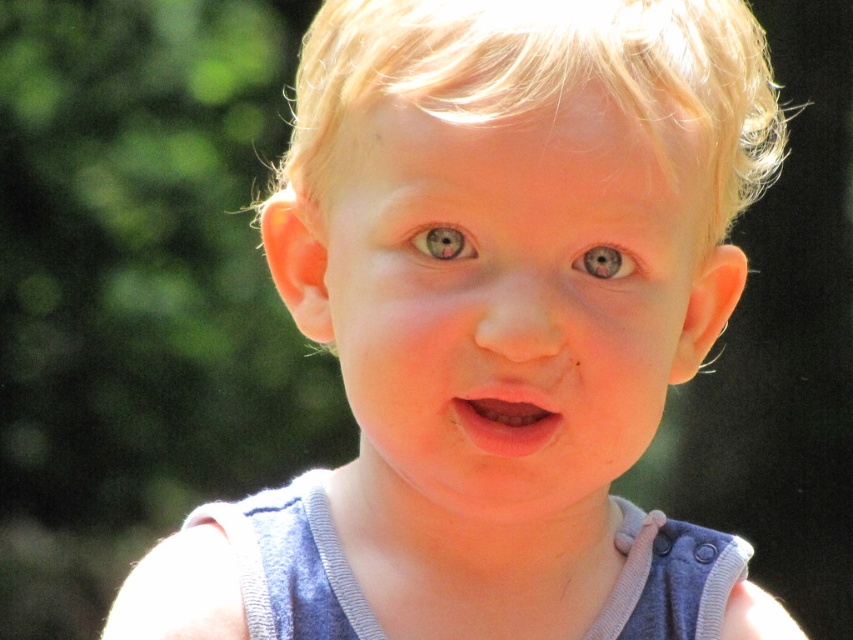
Looking at the child in the image, which object has a bigger size between the smooth skin face at center and the matte gray eye at center?

The smooth skin face at center has a larger size compared to the matte gray eye at center.

What is the exact location of the pink matte lips at center in the image?

The pink matte lips at center are located at point coordinates of 0.656 on the x axis and 0.594 on the y axis.

You are a photographer adjusting the focus on your camera. You want to ensure both the pink matte lips at center and the gray matte eye at upper center are in focus. Given the distance between them, will you need to adjust the focus manually or can you rely on the camera auto focus to capture both clearly?

The pink matte lips at center is 2.47 inches from the gray matte eye at upper center. Since the distance between them is relatively small, the camera auto focus should be able to capture both clearly without needing manual adjustment.